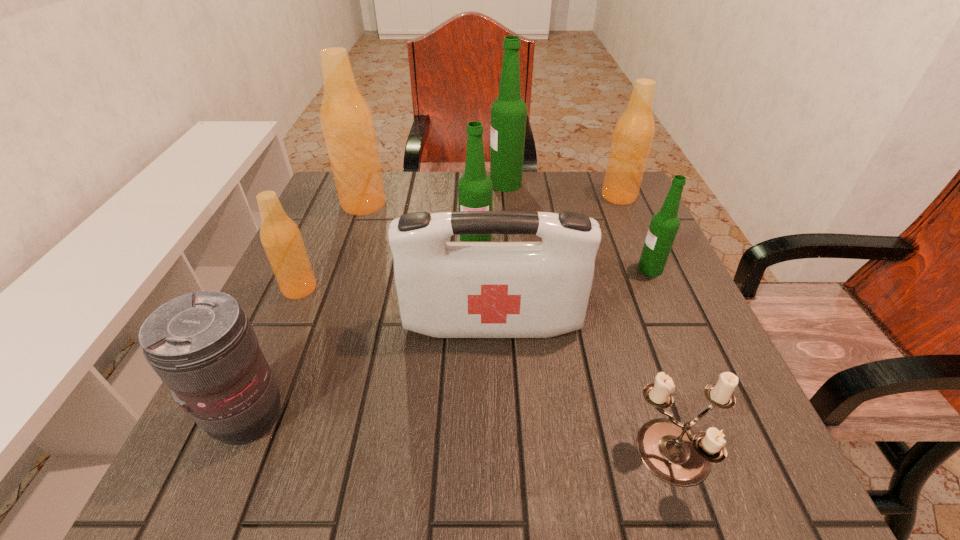
In the image, there is a desktop. Where is `free space at the far right corner`? The height and width of the screenshot is (540, 960). free space at the far right corner is located at coordinates (611, 217).

In the image, there is a desktop. Identify the location of vacant area at the near right corner. (764, 489).

Find the location of `vacant area that lies between the telephoto lens and the farthest green beer bottle`. vacant area that lies between the telephoto lens and the farthest green beer bottle is located at coordinates (377, 300).

The width and height of the screenshot is (960, 540). I want to click on free space between the shortest object and the telephoto lens, so click(x=462, y=436).

At what (x,y) coordinates should I click in order to perform the action: click on free space between the candle holder and the telephoto lens. Please return your answer as a coordinate pair (x, y). The image size is (960, 540). Looking at the image, I should click on (462, 436).

You are a GUI agent. You are given a task and a screenshot of the screen. Output one action in this format:
    pyautogui.click(x=<x>, y=<y>)
    Task: Click on the blank region between the smallest tan beer bottle and the telephoto lens
    The width and height of the screenshot is (960, 540).
    Given the screenshot: What is the action you would take?
    pyautogui.click(x=275, y=352)

Choose which object is the third nearest neighbor to the telephoto lens. Please provide its 2D coordinates. Your answer should be formatted as a tuple, i.e. [(x, y)], where the tuple contains the x and y coordinates of a point satisfying the conditions above.

[(475, 189)]

Locate an element on the screen. object that ranks as the sixth closest to the shortest object is located at coordinates (280, 236).

Image resolution: width=960 pixels, height=540 pixels. Identify the location of beer bottle that is the second closest one to the rightmost tan beer bottle. (664, 225).

Select which beer bottle appears as the third closest to the first-aid kit. Please provide its 2D coordinates. Your answer should be formatted as a tuple, i.e. [(x, y)], where the tuple contains the x and y coordinates of a point satisfying the conditions above.

[(280, 236)]